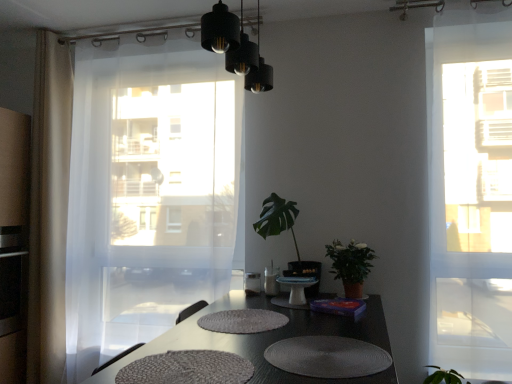
Question: Is white textured placemat at lower center, arranged as the 1th wide when viewed from the right, wider or thinner than white textured placemat at center?

Choices:
 (A) thin
 (B) wide

Answer: (B)

Question: Which is correct: white textured placemat at lower center, the 2th wide viewed from the left, is inside white textured placemat at center, or outside of it?

Choices:
 (A) outside
 (B) inside

Answer: (A)

Question: Which object is the closest to the white textured placemat at lower center, the 2th wide viewed from the left?

Choices:
 (A) green matte plant at right, the first houseplant viewed from the right
 (B) white glossy cake stand at center
 (C) beige sheer curtain at left, acting as the 1th curtain starting from the left
 (D) textured gray placemats at center
 (E) transparent glass window at right

Answer: (D)

Question: Which is nearer to the white glossy cake stand at center?

Choices:
 (A) white textured placemat at center
 (B) green matte plant at center, marked as the second houseplant in a right-to-left arrangement
 (C) gray woven placemat at lower center, arranged as the second wide when viewed from the right
 (D) white textured placemat at lower center, the 2th wide viewed from the left
 (E) transparent white curtain at left, the 1th curtain viewed from the right

Answer: (B)